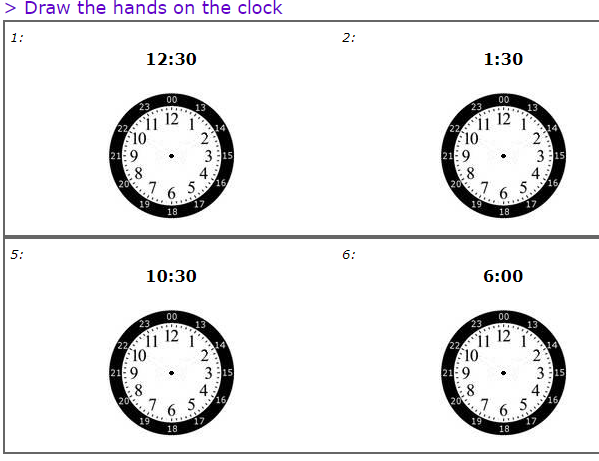
Find the location of a particular element. This screenshot has width=599, height=461. handless clocks is located at coordinates (177, 150), (508, 149), (496, 359), (162, 346).